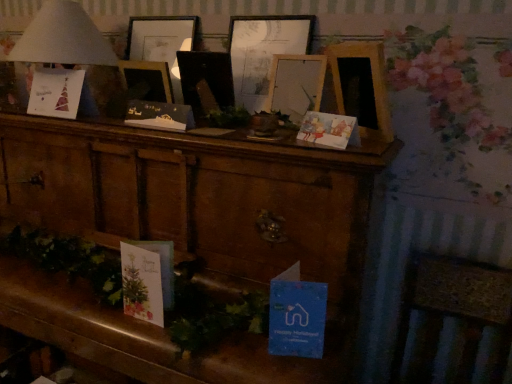
Locate an element on the screen. This screenshot has width=512, height=384. free space in front of matte black card at center, which appears as the second christmas card when viewed from the back is located at coordinates (164, 132).